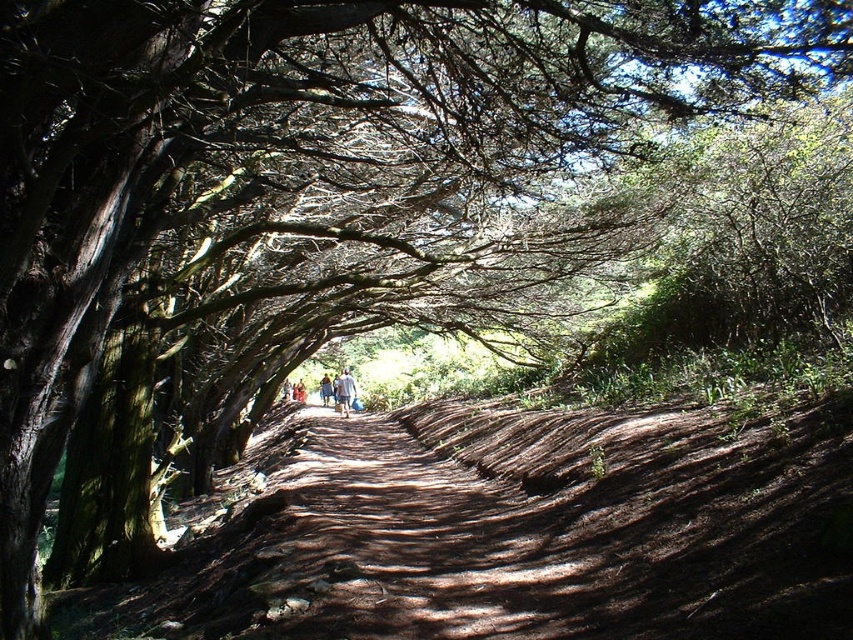
You are a hiker wearing light blue denim jeans at center and carrying a light blue fabric at center. You want to cross a small stream that is just ahead on the path. Which item should you hold higher to keep it dry?

The light blue fabric at center should be held higher than the light blue denim jeans at center because it is positioned in front of the jeans, making it more exposed to the water from the stream.